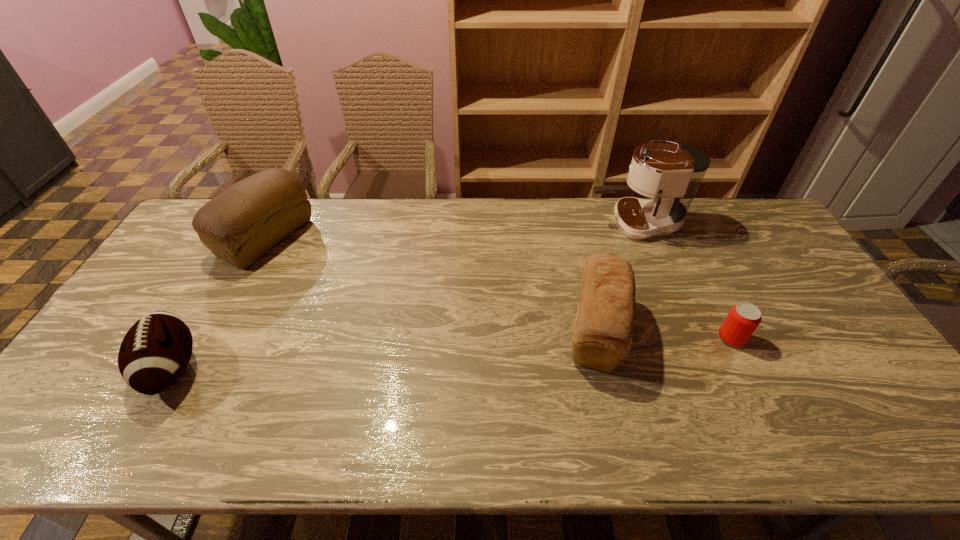
Identify the location of free region located on the back of the second shortest object. (222, 282).

The height and width of the screenshot is (540, 960). In order to click on blank space located on the back of the beer can in this screenshot , I will do `click(688, 252)`.

Find the location of a particular element. The image size is (960, 540). coffee maker present at the far edge is located at coordinates (671, 174).

Find the location of a particular element. bread that is at the far edge is located at coordinates (241, 224).

I want to click on bread that is at the left edge, so click(241, 224).

This screenshot has width=960, height=540. Identify the location of football (American) at the left edge. (154, 353).

You are a GUI agent. You are given a task and a screenshot of the screen. Output one action in this format:
    pyautogui.click(x=<x>, y=<y>)
    Task: Click on the object located in the far left corner section of the desktop
    This screenshot has width=960, height=540.
    Given the screenshot: What is the action you would take?
    pyautogui.click(x=241, y=224)

Where is `vacant space at the far edge of the desktop`? vacant space at the far edge of the desktop is located at coordinates (481, 214).

Locate an element on the screen. This screenshot has width=960, height=540. vacant space at the near edge is located at coordinates (555, 440).

I want to click on vacant space at the left edge, so click(x=205, y=273).